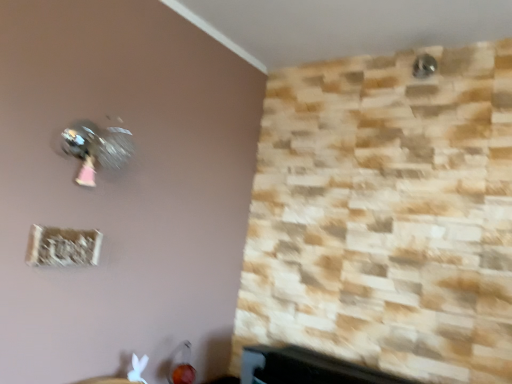
Describe the element at coordinates (306, 368) in the screenshot. This screenshot has width=512, height=384. I see `black plastic tv at lower right` at that location.

Identify the location of black plastic tv at lower right. (306, 368).

The height and width of the screenshot is (384, 512). Find the location of `black plastic tv at lower right`. black plastic tv at lower right is located at coordinates (306, 368).